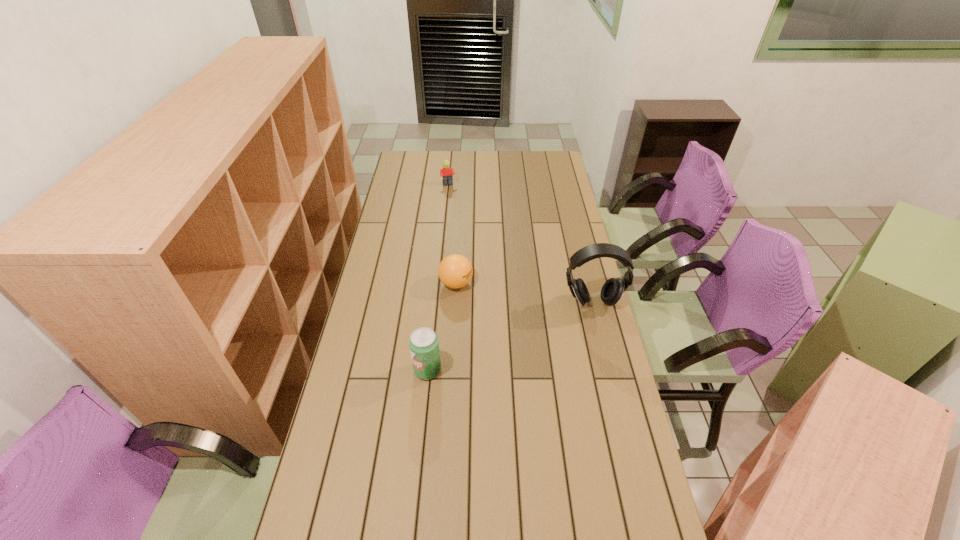
Locate an element on the screen. This screenshot has width=960, height=540. free location located on the face of the Lego is located at coordinates (465, 235).

This screenshot has width=960, height=540. I want to click on vacant space situated 0.300m on the side with brand of the ping-pong ball, so click(519, 342).

Locate an element on the screen. The image size is (960, 540). vacant space located 0.250m on the side with brand of the ping-pong ball is located at coordinates (510, 333).

Identify the location of free region located 0.200m on the side with brand of the ping-pong ball. The width and height of the screenshot is (960, 540). (500, 325).

Find the location of a particular element. This screenshot has width=960, height=540. object that is at the right edge is located at coordinates (612, 290).

The height and width of the screenshot is (540, 960). What are the coordinates of `free space at the near edge` in the screenshot? It's located at (398, 526).

Where is `free space at the left edge of the desktop`? This screenshot has width=960, height=540. free space at the left edge of the desktop is located at coordinates (384, 252).

This screenshot has width=960, height=540. I want to click on vacant space at the right edge of the desktop, so click(581, 232).

Where is `free spot between the Lego and the rightmost object`? The width and height of the screenshot is (960, 540). free spot between the Lego and the rightmost object is located at coordinates (520, 244).

I want to click on free spot between the ping-pong ball and the third shortest object, so click(x=442, y=327).